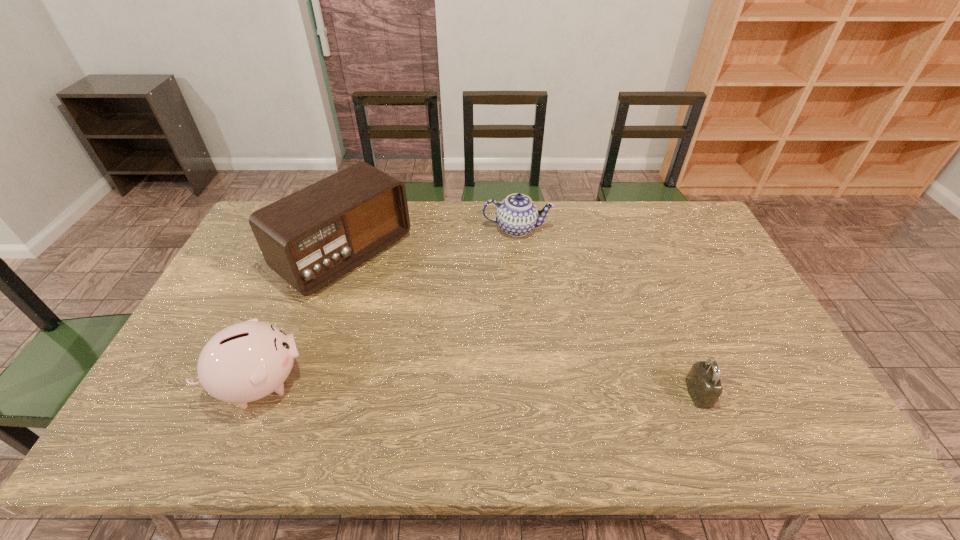
At what (x,y) coordinates should I click in order to perform the action: click on piggy bank. Please return your answer as a coordinate pair (x, y). The width and height of the screenshot is (960, 540). Looking at the image, I should click on (247, 361).

The image size is (960, 540). In order to click on the shortest object in this screenshot , I will do click(703, 382).

The image size is (960, 540). I want to click on padlock, so click(x=703, y=382).

The height and width of the screenshot is (540, 960). In order to click on the tallest object in this screenshot , I will do `click(310, 238)`.

You are a GUI agent. You are given a task and a screenshot of the screen. Output one action in this format:
    pyautogui.click(x=<x>, y=<y>)
    Task: Click on the third object from left to right
    This screenshot has height=540, width=960.
    Given the screenshot: What is the action you would take?
    (517, 215)

The height and width of the screenshot is (540, 960). I want to click on chinaware, so click(x=517, y=215).

Locate an element on the screen. Image resolution: width=960 pixels, height=540 pixels. free space located on the right of the third shortest object is located at coordinates (351, 383).

The image size is (960, 540). Identify the location of free space located at the front of the padlock near the keyhole. (799, 393).

Locate an element on the screen. free space located on the front-facing side of the tallest object is located at coordinates (430, 317).

The image size is (960, 540). In order to click on vacant area situated on the front-facing side of the tallest object in this screenshot , I will do `click(432, 319)`.